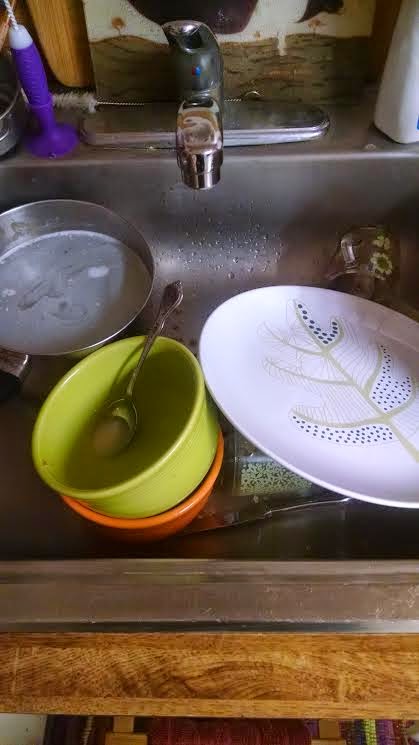
The image size is (419, 745). Identify the location of wooden platform. (106, 665), (287, 659).